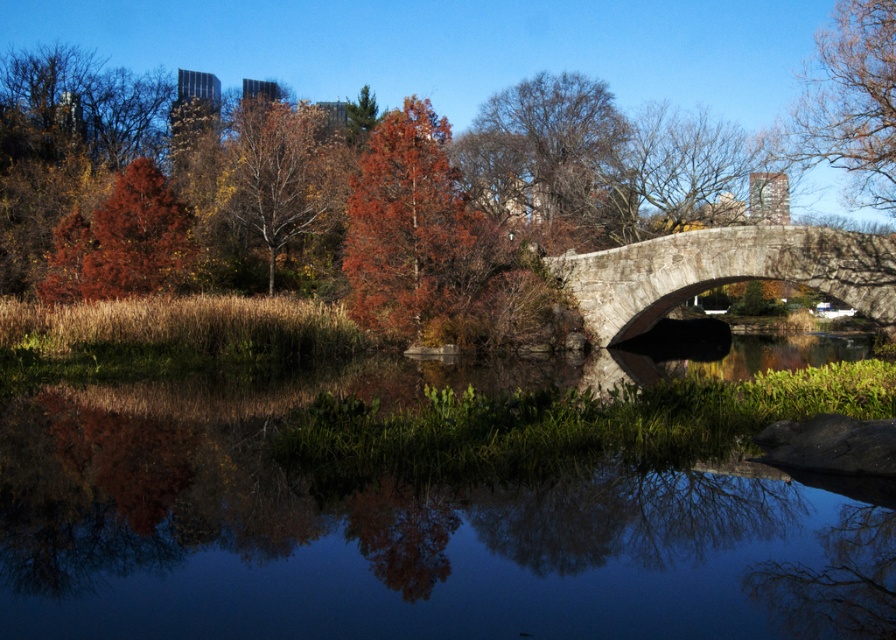
Can you confirm if orange matte tree at center is positioned below orange-brown bark tree at upper center?

Actually, orange matte tree at center is above orange-brown bark tree at upper center.

Between orange matte tree at center and orange-brown bark tree at upper center, which one has less height?

orange-brown bark tree at upper center is shorter.

At what (x,y) coordinates should I click in order to perform the action: click on orange matte tree at center. Please return your answer as a coordinate pair (x, y). This screenshot has height=640, width=896. Looking at the image, I should click on (453, 45).

Does gray stone bridge at right have a greater width compared to orange-brown bark tree at upper center?

No, gray stone bridge at right is not wider than orange-brown bark tree at upper center.

Who is positioned more to the left, gray stone bridge at right or orange-brown bark tree at upper center?

Positioned to the left is orange-brown bark tree at upper center.

Between point (571, 273) and point (269, 173), which one is positioned in front?

Point (571, 273) is more forward.

Locate an element on the screen. gray stone bridge at right is located at coordinates (724, 272).

Is gray stone bridge at right closer to camera compared to bare branches at upper center?

Yes.

Can you confirm if gray stone bridge at right is thinner than bare branches at upper center?

Yes.

Is point (804, 240) positioned in front of point (566, 99)?

That is True.

Where is `gray stone bridge at right`? gray stone bridge at right is located at coordinates (724, 272).